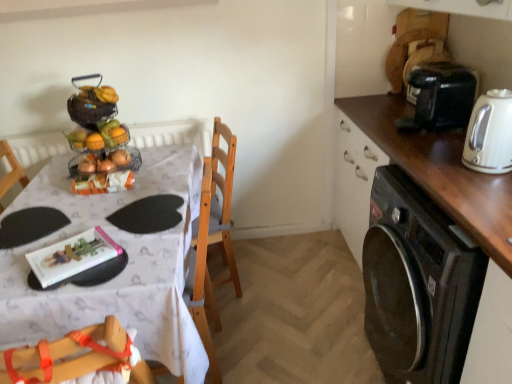
Where is `free location to the right of wire mesh basket at center`? free location to the right of wire mesh basket at center is located at coordinates (159, 162).